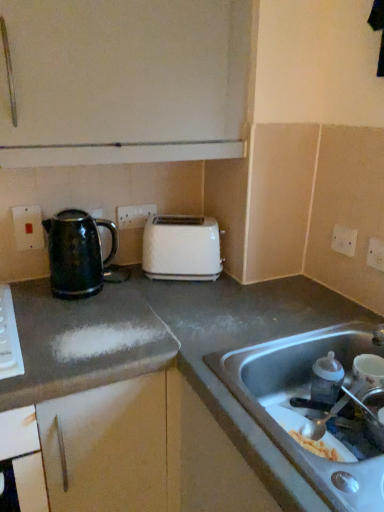
The image size is (384, 512). I want to click on free location in front of shiny metallic kettle at left, so click(x=74, y=315).